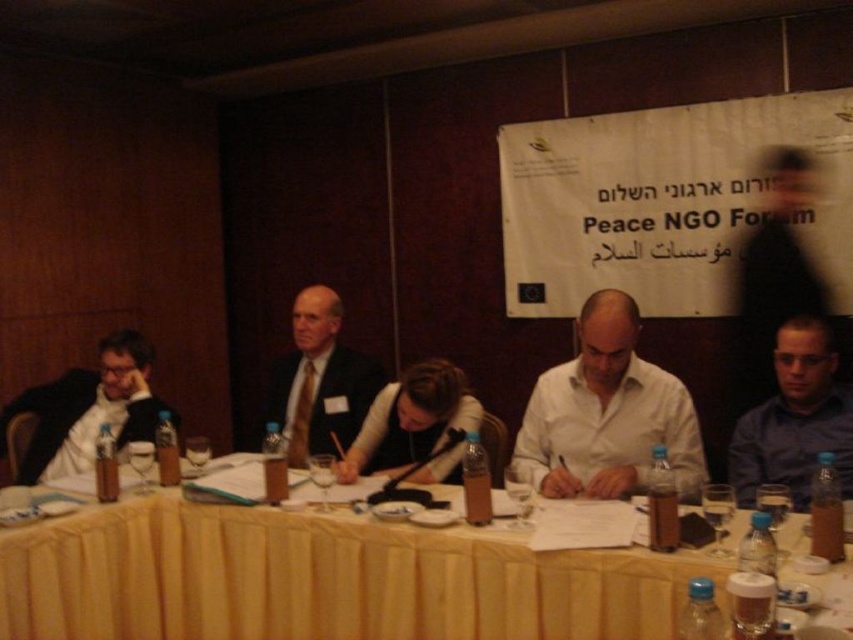
Does point (633, 595) come farther from viewer compared to point (375, 454)?

No, (633, 595) is closer to viewer.

Between yellow fabric table at center and matte black jacket at center, which one is positioned higher?

Positioned higher is matte black jacket at center.

You are a GUI agent. You are given a task and a screenshot of the screen. Output one action in this format:
    pyautogui.click(x=<x>, y=<y>)
    Task: Click on the yellow fabric table at center
    The width and height of the screenshot is (853, 640).
    Given the screenshot: What is the action you would take?
    pyautogui.click(x=323, y=579)

Between white matte shirt at center and blue shirt at right, which one appears on the left side from the viewer's perspective?

From the viewer's perspective, white matte shirt at center appears more on the left side.

Which is in front, point (538, 397) or point (824, 440)?

Point (824, 440)

Where is `white matte shirt at center`? white matte shirt at center is located at coordinates (606, 413).

Who is shorter, white matte shirt at center or matte black jacket at center?

Standing shorter between the two is matte black jacket at center.

Does white matte shirt at center appear on the left side of matte black jacket at center?

In fact, white matte shirt at center is to the right of matte black jacket at center.

Which is in front, point (631, 486) or point (469, 419)?

Point (631, 486) is in front.

Locate an element on the screen. This screenshot has height=640, width=853. white matte shirt at center is located at coordinates (606, 413).